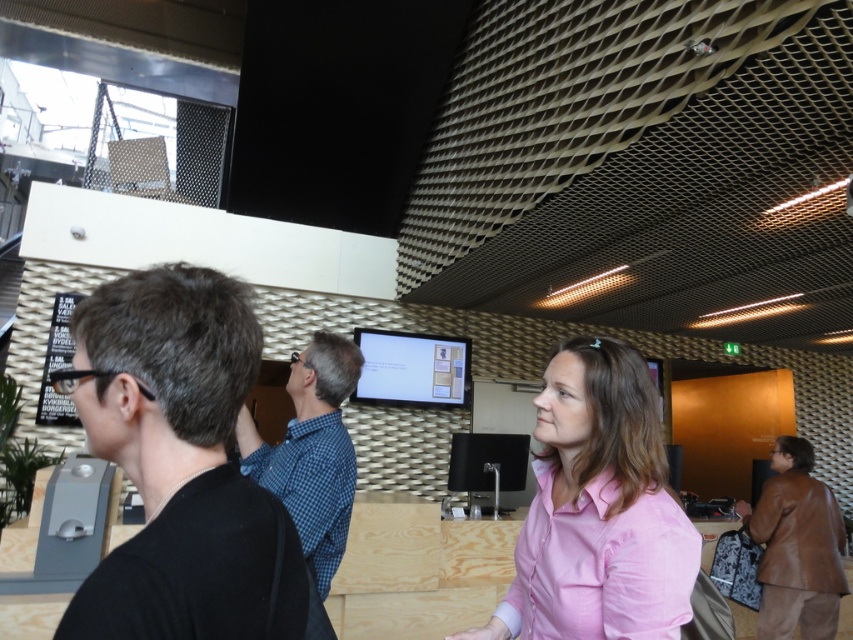
Question: Which object is the closest to the brown leather jacket at lower right?

Choices:
 (A) blue checkered shirt at center
 (B) matte white monitor at center
 (C) black matte shirt at left

Answer: (B)

Question: Is pink fabric shirt at center smaller than blue checkered shirt at center?

Choices:
 (A) no
 (B) yes

Answer: (B)

Question: Which of the following is the farthest from the observer?

Choices:
 (A) click(x=167, y=636)
 (B) click(x=332, y=385)

Answer: (B)

Question: Which of the following is the closest to the observer?

Choices:
 (A) matte white monitor at center
 (B) black matte shirt at left

Answer: (B)

Question: Does pink fabric shirt at center appear under blue checkered shirt at center?

Choices:
 (A) no
 (B) yes

Answer: (B)

Question: From the image, what is the correct spatial relationship of black matte shirt at left in relation to brown leather jacket at lower right?

Choices:
 (A) left
 (B) right

Answer: (A)